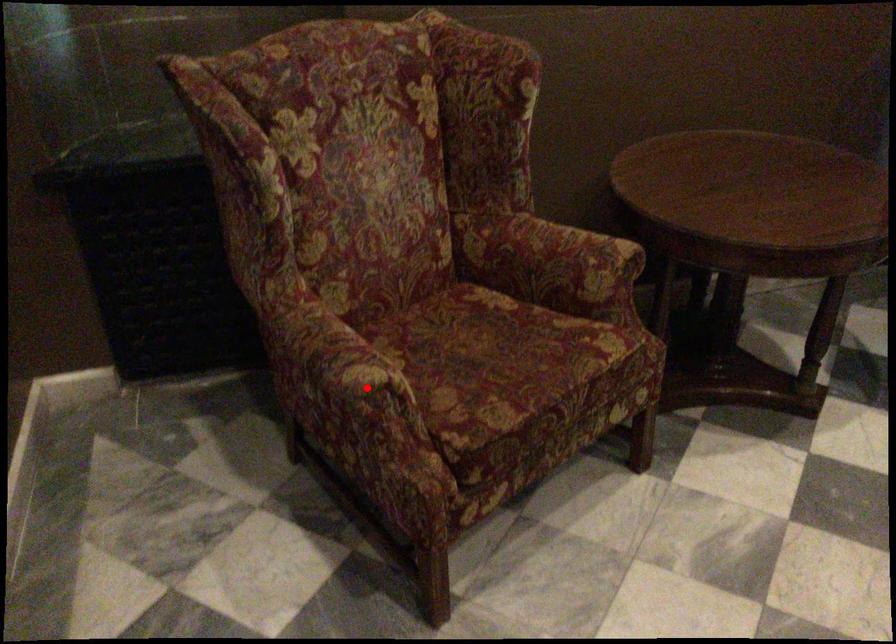
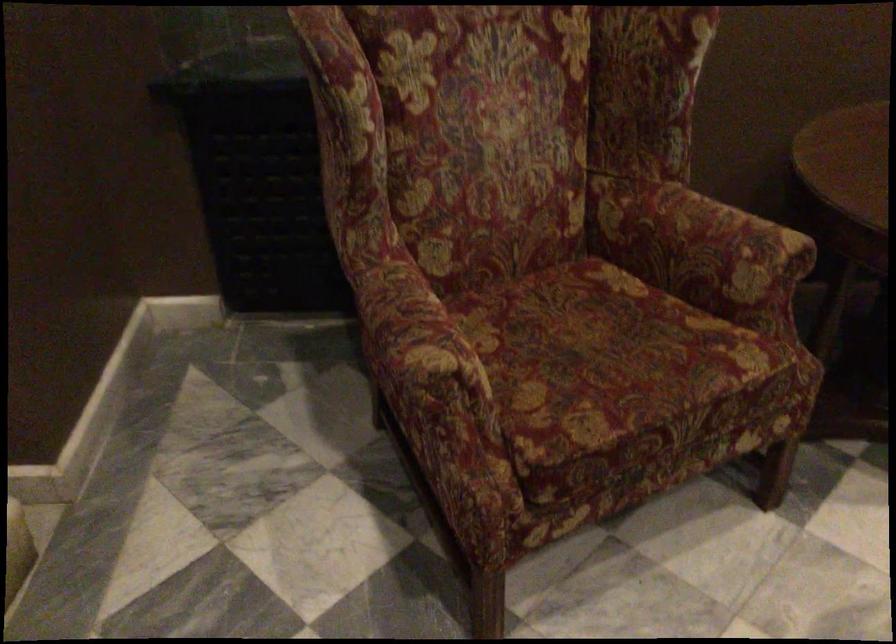
The point at the highlighted location is marked in the first image. Where is the corresponding point in the second image?

(428, 377)